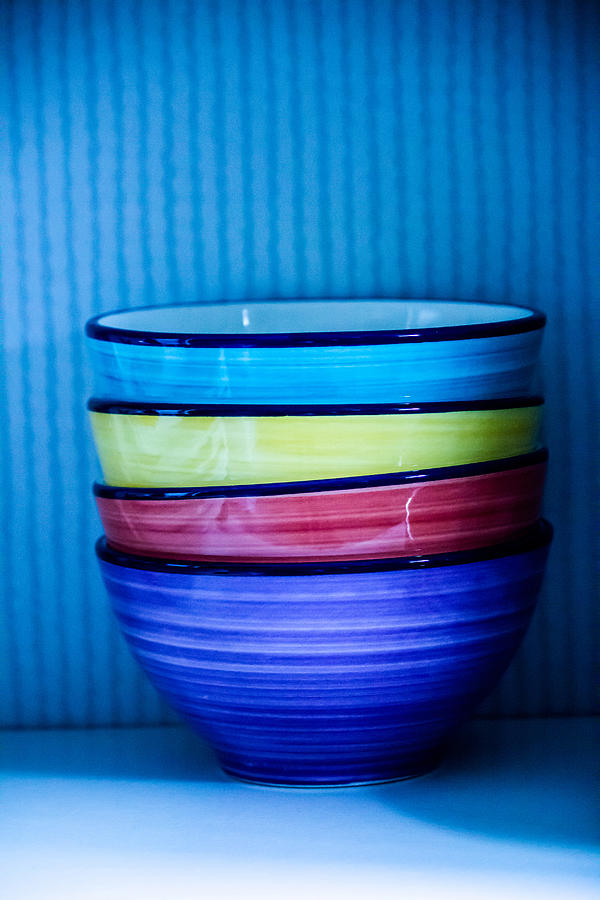
Where is `vertical striped blue wallpaper`? vertical striped blue wallpaper is located at coordinates pyautogui.click(x=289, y=198).